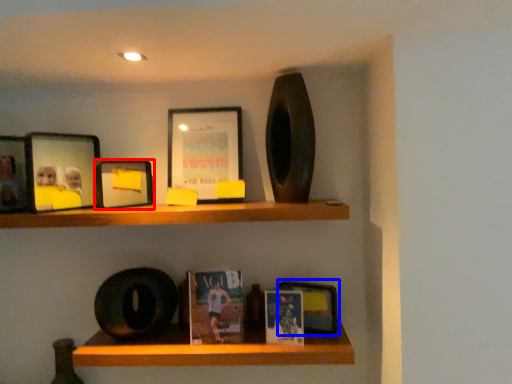
Question: Among these objects, which one is nearest to the camera, picture frame (highlighted by a red box) or book cover (highlighted by a blue box)?

Choices:
 (A) picture frame
 (B) book cover

Answer: (A)